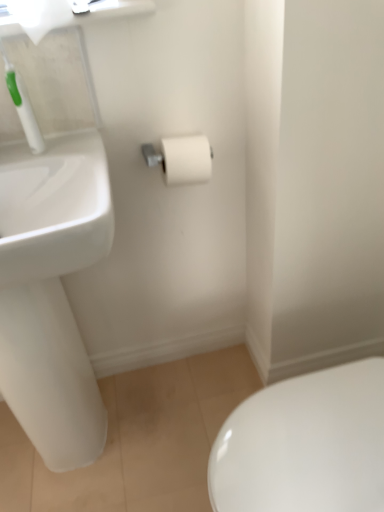
The height and width of the screenshot is (512, 384). I want to click on white plastic toothbrush at upper left, so click(24, 108).

The width and height of the screenshot is (384, 512). Describe the element at coordinates (51, 292) in the screenshot. I see `white glossy sink at left` at that location.

Where is `white plastic toothbrush at upper left`? The width and height of the screenshot is (384, 512). white plastic toothbrush at upper left is located at coordinates (24, 108).

From the picture: Is white matte toilet paper at center, marked as the 1th toilet paper in a back-to-front arrangement, inside the boundaries of white matte toilet paper at upper left, the 1th toilet paper viewed from the front, or outside?

The correct answer is: outside.

From a real-world perspective, is white matte toilet paper at center, which is the 2th toilet paper from left to right, physically above white matte toilet paper at upper left, the 1th toilet paper in the top-to-bottom sequence?

No, from a real-world perspective, white matte toilet paper at center, which is the 2th toilet paper from left to right, is not above white matte toilet paper at upper left, the 1th toilet paper in the top-to-bottom sequence.

Is white matte toilet paper at center, which is the 2th toilet paper from left to right, aimed at white matte toilet paper at upper left, which appears as the first toilet paper when viewed from the left?

No, white matte toilet paper at center, which is the 2th toilet paper from left to right, is not aimed at white matte toilet paper at upper left, which appears as the first toilet paper when viewed from the left.

Is white matte toilet paper at center, arranged as the second toilet paper when viewed from the top, wider than white matte toilet paper at upper left, arranged as the second toilet paper when viewed from the back?

Correct, the width of white matte toilet paper at center, arranged as the second toilet paper when viewed from the top, exceeds that of white matte toilet paper at upper left, arranged as the second toilet paper when viewed from the back.

Which of these two, white glossy sink at left or white plastic toothbrush at upper left, is bigger?

Bigger between the two is white glossy sink at left.

Measure the distance from white glossy sink at left to white plastic toothbrush at upper left.

36.59 centimeters.

From the image's perspective, does white glossy sink at left appear lower than white plastic toothbrush at upper left?

Correct, white glossy sink at left appears lower than white plastic toothbrush at upper left in the image.

From a real-world perspective, is white glossy sink at left over white plastic toothbrush at upper left?

Incorrect, from a real-world perspective, white glossy sink at left is lower than white plastic toothbrush at upper left.

From the image's perspective, between white matte toilet paper at upper left, the 1th toilet paper viewed from the front, and white glossy sink at left, which one is located above?

white matte toilet paper at upper left, the 1th toilet paper viewed from the front.

Considering the positions of point (32, 3) and point (104, 245), is point (32, 3) closer or farther from the camera than point (104, 245)?

Point (32, 3) appears to be farther away from the viewer than point (104, 245).

Is white matte toilet paper at upper left, which appears as the first toilet paper when viewed from the left, positioned with its back to white glossy sink at left?

No.

Considering the relative sizes of white matte toilet paper at upper left, the 1th toilet paper viewed from the front, and white glossy sink at left in the image provided, is white matte toilet paper at upper left, the 1th toilet paper viewed from the front, thinner than white glossy sink at left?

Correct, the width of white matte toilet paper at upper left, the 1th toilet paper viewed from the front, is less than that of white glossy sink at left.

From a real-world perspective, who is located higher, white matte toilet paper at upper left, the second toilet paper from the right, or white matte toilet paper at center, which is the first toilet paper in bottom-to-top order?

In real-world perspective, white matte toilet paper at upper left, the second toilet paper from the right, is above.

Is white matte toilet paper at upper left, the 1th toilet paper in the top-to-bottom sequence, next to white matte toilet paper at center, which is the first toilet paper in bottom-to-top order, and touching it?

No, white matte toilet paper at upper left, the 1th toilet paper in the top-to-bottom sequence, is not next to white matte toilet paper at center, which is the first toilet paper in bottom-to-top order.

Is white matte toilet paper at upper left, which appears as the 2th toilet paper when ordered from the bottom, taller or shorter than white matte toilet paper at center, the 2th toilet paper in the front-to-back sequence?

Considering their sizes, white matte toilet paper at upper left, which appears as the 2th toilet paper when ordered from the bottom, has more height than white matte toilet paper at center, the 2th toilet paper in the front-to-back sequence.

Is the surface of white glossy sink at left in direct contact with white matte toilet paper at center, marked as the 1th toilet paper in a back-to-front arrangement?

There is a gap between white glossy sink at left and white matte toilet paper at center, marked as the 1th toilet paper in a back-to-front arrangement.

I want to click on sink below the white matte toilet paper at center, the 2th toilet paper in the front-to-back sequence (from the image's perspective), so click(51, 292).

Based on the photo, from a real-world perspective, is white glossy sink at left above or below white matte toilet paper at center, the 2th toilet paper in the front-to-back sequence?

white glossy sink at left is below white matte toilet paper at center, the 2th toilet paper in the front-to-back sequence.

Considering the relative sizes of white glossy sink at left and white matte toilet paper at center, arranged as the second toilet paper when viewed from the top, in the image provided, is white glossy sink at left smaller than white matte toilet paper at center, arranged as the second toilet paper when viewed from the top,?

No, white glossy sink at left is not smaller than white matte toilet paper at center, arranged as the second toilet paper when viewed from the top.

Considering the relative sizes of white plastic toothbrush at upper left and white glossy sink at left in the image provided, is white plastic toothbrush at upper left bigger than white glossy sink at left?

Actually, white plastic toothbrush at upper left might be smaller than white glossy sink at left.

Is white plastic toothbrush at upper left with white glossy sink at left?

No, white plastic toothbrush at upper left is not touching white glossy sink at left.

From a real-world perspective, relative to white glossy sink at left, is white plastic toothbrush at upper left vertically above or below?

white plastic toothbrush at upper left is above white glossy sink at left.

Looking at this image, would you say white plastic toothbrush at upper left is outside white glossy sink at left?

Indeed, white plastic toothbrush at upper left is completely outside white glossy sink at left.

Is white matte toilet paper at center, arranged as the second toilet paper when viewed from the top, at the left side of white glossy sink at left?

Incorrect, white matte toilet paper at center, arranged as the second toilet paper when viewed from the top, is not on the left side of white glossy sink at left.

Measure the distance between white matte toilet paper at center, which is the 2th toilet paper from left to right, and white glossy sink at left.

A distance of 16.31 inches exists between white matte toilet paper at center, which is the 2th toilet paper from left to right, and white glossy sink at left.

Considering the relative sizes of white matte toilet paper at center, marked as the 1th toilet paper in a back-to-front arrangement, and white glossy sink at left in the image provided, is white matte toilet paper at center, marked as the 1th toilet paper in a back-to-front arrangement, wider than white glossy sink at left?

Incorrect, the width of white matte toilet paper at center, marked as the 1th toilet paper in a back-to-front arrangement, does not surpass that of white glossy sink at left.

From the image's perspective, is white matte toilet paper at center, marked as the 1th toilet paper in a back-to-front arrangement, below white glossy sink at left?

No.

I want to click on toilet paper to the left of white matte toilet paper at center, the first toilet paper positioned from the right, so click(x=40, y=16).

This screenshot has width=384, height=512. Identify the location of sink directly beneath the white plastic toothbrush at upper left (from a real-world perspective). (51, 292).

Considering their positions, is white matte toilet paper at upper left, the 1th toilet paper in the top-to-bottom sequence, positioned further to white matte toilet paper at center, which is the 2th toilet paper from left to right, than white plastic toothbrush at upper left?

Based on the image, white matte toilet paper at upper left, the 1th toilet paper in the top-to-bottom sequence, appears to be further to white matte toilet paper at center, which is the 2th toilet paper from left to right.

Considering their positions, is white matte toilet paper at upper left, the 1th toilet paper in the top-to-bottom sequence, positioned further to white matte toilet paper at center, marked as the 1th toilet paper in a back-to-front arrangement, than white glossy sink at left?

The object further to white matte toilet paper at center, marked as the 1th toilet paper in a back-to-front arrangement, is white glossy sink at left.

Based on their spatial positions, is white matte toilet paper at upper left, the second toilet paper from the right, or white glossy sink at left closer to white plastic toothbrush at upper left?

white matte toilet paper at upper left, the second toilet paper from the right, is closer to white plastic toothbrush at upper left.

When comparing their distances from white glossy sink at left, does white matte toilet paper at upper left, the 1th toilet paper viewed from the front, or white matte toilet paper at center, the 2th toilet paper in the front-to-back sequence, seem further?

white matte toilet paper at upper left, the 1th toilet paper viewed from the front, is further to white glossy sink at left.

Estimate the real-world distances between objects in this image. Which object is further from white plastic toothbrush at upper left, white glossy sink at left or white matte toilet paper at upper left, the 1th toilet paper viewed from the front?

Among the two, white glossy sink at left is located further to white plastic toothbrush at upper left.

Considering their positions, is white matte toilet paper at center, which is the first toilet paper in bottom-to-top order, positioned closer to white plastic toothbrush at upper left than white matte toilet paper at upper left, arranged as the second toilet paper when viewed from the back?

The object closer to white plastic toothbrush at upper left is white matte toilet paper at upper left, arranged as the second toilet paper when viewed from the back.

Estimate the real-world distances between objects in this image. Which object is closer to white glossy sink at left, white plastic toothbrush at upper left or white matte toilet paper at upper left, arranged as the second toilet paper when viewed from the back?

white plastic toothbrush at upper left lies closer to white glossy sink at left than the other object.

Looking at this image, which object lies nearer to the anchor point white matte toilet paper at center, arranged as the second toilet paper when viewed from the top, white plastic toothbrush at upper left or white matte toilet paper at upper left, which appears as the 2th toilet paper when ordered from the bottom?

The object closer to white matte toilet paper at center, arranged as the second toilet paper when viewed from the top, is white plastic toothbrush at upper left.

Locate an element on the screen. toilet paper between white matte toilet paper at upper left, which appears as the 2th toilet paper when ordered from the bottom, and white glossy sink at left vertically is located at coordinates (187, 159).

You are a GUI agent. You are given a task and a screenshot of the screen. Output one action in this format:
    pyautogui.click(x=<x>, y=<y>)
    Task: Click on the toilet paper between white plastic toothbrush at upper left and white matte toilet paper at center, marked as the 1th toilet paper in a back-to-front arrangement, in the horizontal direction
    The width and height of the screenshot is (384, 512).
    Given the screenshot: What is the action you would take?
    pyautogui.click(x=40, y=16)

Image resolution: width=384 pixels, height=512 pixels. Find the location of `toilet paper between white plastic toothbrush at upper left and white glossy sink at left in the up-down direction`. toilet paper between white plastic toothbrush at upper left and white glossy sink at left in the up-down direction is located at coordinates (187, 159).

Where is `plumbing fixture between white matte toilet paper at upper left, the 1th toilet paper in the top-to-bottom sequence, and white glossy sink at left, in the vertical direction`? Image resolution: width=384 pixels, height=512 pixels. plumbing fixture between white matte toilet paper at upper left, the 1th toilet paper in the top-to-bottom sequence, and white glossy sink at left, in the vertical direction is located at coordinates (24, 108).